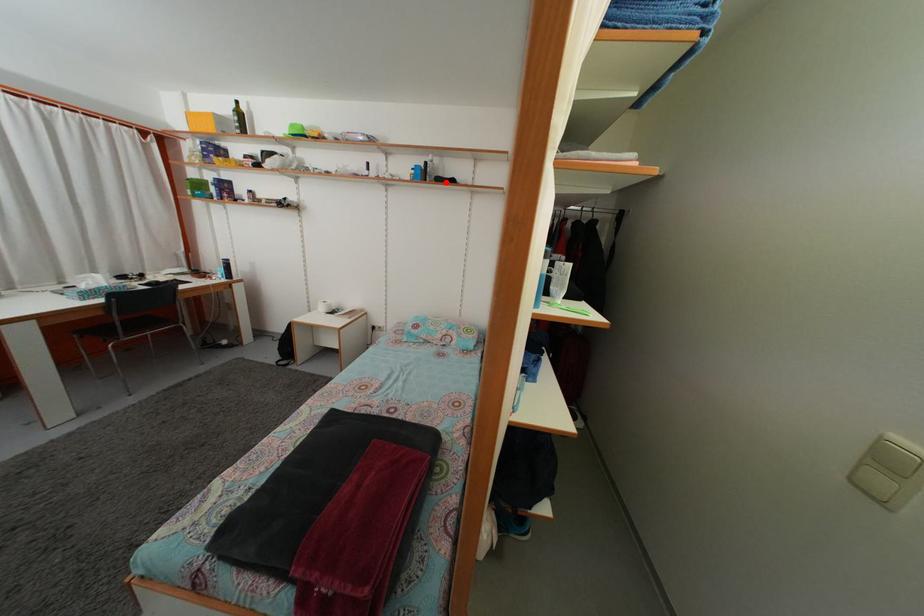
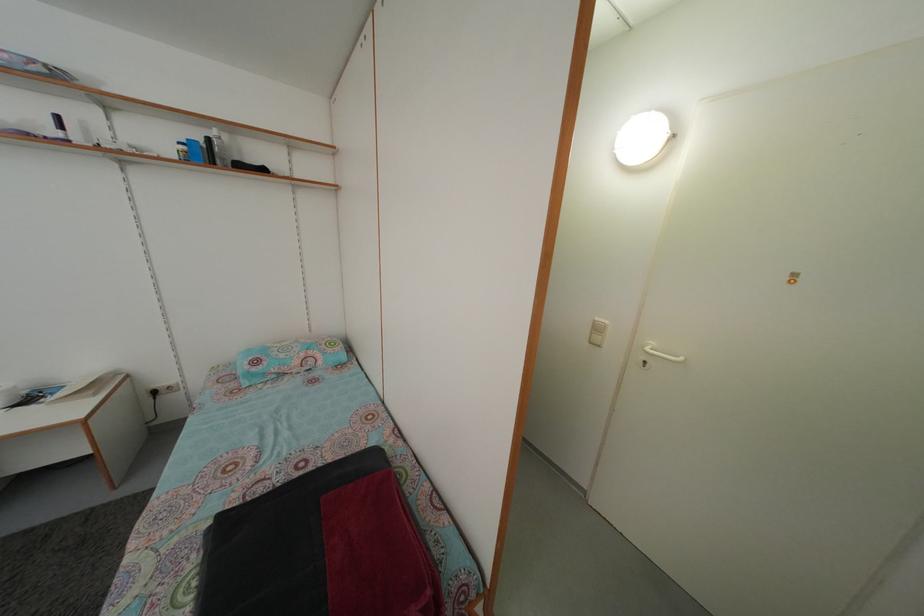
In the second image, find the point that corresponds to the highlighted location in the first image.

(242, 166)